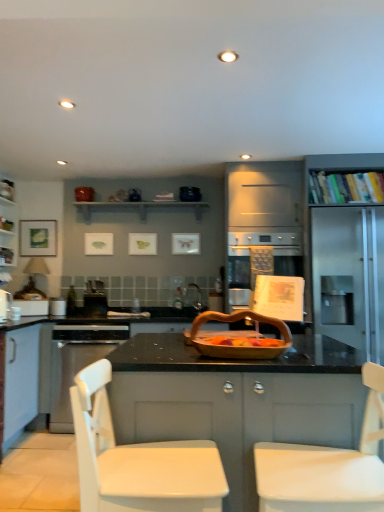
The width and height of the screenshot is (384, 512). What do you see at coordinates (5, 305) in the screenshot? I see `metallic silver toaster at left, which is counted as the 1th appliance, starting from the left` at bounding box center [5, 305].

What is the approximate width of matte white picture frame at left?

matte white picture frame at left is 7.79 centimeters wide.

What do you see at coordinates (78, 362) in the screenshot?
I see `satin black dishwasher at left` at bounding box center [78, 362].

The image size is (384, 512). Describe the element at coordinates (8, 224) in the screenshot. I see `white glossy cabinet at left, placed as the 1th cabinetry when sorted from top to bottom` at that location.

What do you see at coordinates (237, 346) in the screenshot?
I see `wooden basket at center` at bounding box center [237, 346].

This screenshot has height=512, width=384. Describe the element at coordinates (95, 304) in the screenshot. I see `brushed metal toaster at center, the 1th appliance positioned from the back` at that location.

In order to face brushed metal toaster at center, acting as the 1th appliance starting from the right, should I rotate leftwards or rightwards?

You should look left and rotate roughly 12.302 degrees.

Describe the element at coordinates (139, 207) in the screenshot. I see `matte black shelf at upper center, the second shelf from the front` at that location.

Identify the location of metallic silver toaster at left, which is the second appliance in right-to-left order. (5, 305).

From the picture: Is matte white picture frame at left at the left side of metallic silver toaster at left, arranged as the second appliance when viewed from the back?

Correct, you'll find matte white picture frame at left to the left of metallic silver toaster at left, arranged as the second appliance when viewed from the back.

Considering the sizes of matte white picture frame at left and metallic silver toaster at left, arranged as the second appliance when viewed from the back, in the image, is matte white picture frame at left wider or thinner than metallic silver toaster at left, arranged as the second appliance when viewed from the back,?

Clearly, matte white picture frame at left has less width compared to metallic silver toaster at left, arranged as the second appliance when viewed from the back.

Identify the location of picture frame behind the metallic silver toaster at left, arranged as the second appliance when viewed from the back. (38, 238).

Looking at the image, does matte white picture frame at left seem bigger or smaller compared to metallic silver toaster at left, arranged as the second appliance when viewed from the back?

In the image, matte white picture frame at left appears to be larger than metallic silver toaster at left, arranged as the second appliance when viewed from the back.

Considering the sizes of objects white matte cabinet at center, the second cabinetry viewed from the left, and wooden basket at center in the image provided, who is smaller, white matte cabinet at center, the second cabinetry viewed from the left, or wooden basket at center?

With smaller size is wooden basket at center.

From the image's perspective, between white matte cabinet at center, the second cabinetry positioned from the back, and wooden basket at center, who is located below?

white matte cabinet at center, the second cabinetry positioned from the back, is shown below in the image.

Does white matte cabinet at center, the first cabinetry when ordered from bottom to top, appear on the right side of wooden basket at center?

Correct, you'll find white matte cabinet at center, the first cabinetry when ordered from bottom to top, to the right of wooden basket at center.

Is white matte cabinet at center, the second cabinetry viewed from the left, not inside wooden basket at center?

Indeed, white matte cabinet at center, the second cabinetry viewed from the left, is completely outside wooden basket at center.

From the image's perspective, who appears lower, white matte chair at lower right, the second chair viewed from the left, or brushed metal toaster at center, the 1th appliance positioned from the back?

white matte chair at lower right, the second chair viewed from the left, from the image's perspective.

Who is bigger, white matte chair at lower right, the second chair viewed from the left, or brushed metal toaster at center, the 1th appliance positioned from the back?

white matte chair at lower right, the second chair viewed from the left, is bigger.

From a real-world perspective, is white matte chair at lower right, acting as the 1th chair starting from the right, under brushed metal toaster at center, the 2th appliance viewed from the left?

Yes, from a real-world perspective, white matte chair at lower right, acting as the 1th chair starting from the right, is under brushed metal toaster at center, the 2th appliance viewed from the left.

Visually, is white matte chair at lower right, the second chair viewed from the left, positioned to the left or to the right of brushed metal toaster at center, the 2th appliance viewed from the left?

Clearly, white matte chair at lower right, the second chair viewed from the left, is on the right of brushed metal toaster at center, the 2th appliance viewed from the left, in the image.

From a real-world perspective, between white matte chair at center, which ranks as the first chair in left-to-right order, and satin black dishwasher at left, who is vertically higher?

white matte chair at center, which ranks as the first chair in left-to-right order, from a real-world perspective.

Which is farther from the camera, (97, 484) or (62, 354)?

Positioned behind is point (62, 354).

In terms of width, does white matte chair at center, the second chair viewed from the right, look wider or thinner when compared to satin black dishwasher at left?

Considering their sizes, white matte chair at center, the second chair viewed from the right, looks slimmer than satin black dishwasher at left.

In terms of size, does white matte chair at center, the second chair viewed from the right, appear bigger or smaller than satin black dishwasher at left?

Clearly, white matte chair at center, the second chair viewed from the right, is smaller in size than satin black dishwasher at left.

Does white matte chair at lower right, acting as the 1th chair starting from the right, have a lesser height compared to wooden basket at center?

Incorrect, the height of white matte chair at lower right, acting as the 1th chair starting from the right, does not fall short of that of wooden basket at center.

There is a white matte chair at lower right, the second chair viewed from the left. Where is `basket above it (from a real-world perspective)`? basket above it (from a real-world perspective) is located at coordinates (237, 346).

From a real-world perspective, who is located lower, white matte chair at lower right, the second chair viewed from the left, or wooden basket at center?

white matte chair at lower right, the second chair viewed from the left, from a real-world perspective.

In the scene shown: Measure the distance from white matte chair at lower right, the second chair viewed from the left, to wooden basket at center.

white matte chair at lower right, the second chair viewed from the left, and wooden basket at center are 16.42 inches apart.

Can you confirm if hardcover books at upper right, which is counted as the second shelf, starting from the left, is positioned to the left of matte white picture frame at left?

Incorrect, hardcover books at upper right, which is counted as the second shelf, starting from the left, is not on the left side of matte white picture frame at left.

Considering the sizes of objects hardcover books at upper right, which is counted as the second shelf, starting from the left, and matte white picture frame at left in the image provided, who is taller, hardcover books at upper right, which is counted as the second shelf, starting from the left, or matte white picture frame at left?

matte white picture frame at left is taller.

Are hardcover books at upper right, which is counted as the second shelf, starting from the left, and matte white picture frame at left far apart?

Yes, hardcover books at upper right, which is counted as the second shelf, starting from the left, is far from matte white picture frame at left.

Is matte white picture frame at left a part of hardcover books at upper right, which is the 1th shelf from front to back?

No, hardcover books at upper right, which is the 1th shelf from front to back, does not contain matte white picture frame at left.

Is white matte chair at center, the second chair viewed from the right, thinner than hardcover books at upper right, positioned as the 2th shelf in back-to-front order?

In fact, white matte chair at center, the second chair viewed from the right, might be wider than hardcover books at upper right, positioned as the 2th shelf in back-to-front order.

Measure the distance between white matte chair at center, the second chair viewed from the right, and hardcover books at upper right, which is the 1th shelf from front to back.

2.46 meters.

In the scene shown: Is white matte chair at center, the second chair viewed from the right, bigger or smaller than hardcover books at upper right, which is counted as the second shelf, starting from the left?

Considering their sizes, white matte chair at center, the second chair viewed from the right, takes up more space than hardcover books at upper right, which is counted as the second shelf, starting from the left.

From a real-world perspective, is white matte chair at center, which ranks as the first chair in left-to-right order, over hardcover books at upper right, which is counted as the second shelf, starting from the left?

No, from a real-world perspective, white matte chair at center, which ranks as the first chair in left-to-right order, is not over hardcover books at upper right, which is counted as the second shelf, starting from the left

This screenshot has width=384, height=512. In order to click on picture frame behind the metallic silver toaster at left, arranged as the second appliance when viewed from the back in this screenshot , I will do `click(38, 238)`.

This screenshot has height=512, width=384. Find the location of `basket above the white matte cabinet at center, positioned as the 1th cabinetry in front-to-back order (from the image's perspective)`. basket above the white matte cabinet at center, positioned as the 1th cabinetry in front-to-back order (from the image's perspective) is located at coordinates (237, 346).

From the image, which object appears to be nearer to matte white picture frame at left, satin black dishwasher at left or brushed metal toaster at center, the 1th appliance positioned from the back?

The object closer to matte white picture frame at left is brushed metal toaster at center, the 1th appliance positioned from the back.

Looking at the image, which one is located closer to metallic silver toaster at left, which is counted as the 1th appliance, starting from the left, matte black shelf at upper center, the 1th shelf viewed from the back, or white matte chair at center, the second chair viewed from the right?

matte black shelf at upper center, the 1th shelf viewed from the back, lies closer to metallic silver toaster at left, which is counted as the 1th appliance, starting from the left, than the other object.

Estimate the real-world distances between objects in this image. Which object is further from satin black dishwasher at left, white matte chair at center, the second chair viewed from the right, or white matte chair at lower right, acting as the 1th chair starting from the right?

white matte chair at lower right, acting as the 1th chair starting from the right, lies further to satin black dishwasher at left than the other object.

From the image, which object appears to be nearer to white matte chair at lower right, acting as the 1th chair starting from the right, metallic silver toaster at left, arranged as the second appliance when viewed from the back, or hardcover books at upper right, which is counted as the 1th shelf, starting from the right?

hardcover books at upper right, which is counted as the 1th shelf, starting from the right.

From the image, which object appears to be nearer to metallic silver toaster at left, which ranks as the 1th appliance in front-to-back order, satin black dishwasher at left or white matte cabinet at center, the second cabinetry positioned from the back?

satin black dishwasher at left is positioned closer to the anchor metallic silver toaster at left, which ranks as the 1th appliance in front-to-back order.

Based on their spatial positions, is white matte cabinet at center, the second cabinetry viewed from the left, or matte white picture frame at left further from wooden basket at center?

Based on the image, matte white picture frame at left appears to be further to wooden basket at center.

From the picture: Looking at the image, which one is located closer to satin black dishwasher at left, matte black shelf at upper center, the first shelf viewed from the left, or white matte cabinet at center, the second cabinetry viewed from the left?

The object closer to satin black dishwasher at left is matte black shelf at upper center, the first shelf viewed from the left.

Estimate the real-world distances between objects in this image. Which object is further from brushed metal toaster at center, which ranks as the second appliance in front-to-back order, matte white picture frame at left or metallic silver toaster at left, arranged as the second appliance when viewed from the back?

matte white picture frame at left lies further to brushed metal toaster at center, which ranks as the second appliance in front-to-back order, than the other object.

The height and width of the screenshot is (512, 384). Identify the location of shelf located between white matte cabinet at center, the second cabinetry viewed from the left, and brushed metal toaster at center, acting as the 1th appliance starting from the right, in the depth direction. (346, 185).

The image size is (384, 512). In order to click on chair between white matte chair at lower right, acting as the 1th chair starting from the right, and brushed metal toaster at center, acting as the 1th appliance starting from the right, along the z-axis in this screenshot , I will do `click(138, 460)`.

The width and height of the screenshot is (384, 512). I want to click on picture frame situated between white glossy cabinet at left, the 1th cabinetry from the back, and matte black shelf at upper center, placed as the second shelf when sorted from right to left, from left to right, so click(x=38, y=238).

Where is `shelf between wooden basket at center and matte black shelf at upper center, the 1th shelf viewed from the back, along the z-axis`? Image resolution: width=384 pixels, height=512 pixels. shelf between wooden basket at center and matte black shelf at upper center, the 1th shelf viewed from the back, along the z-axis is located at coordinates (346, 185).